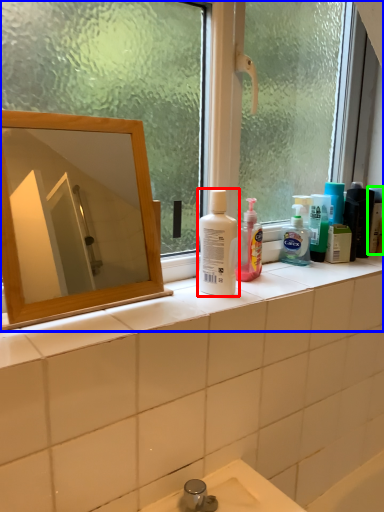
Question: Which is nearer to the cleaning product (highlighted by a red box)? window (highlighted by a blue box) or toiletry (highlighted by a green box).

Choices:
 (A) window
 (B) toiletry

Answer: (A)